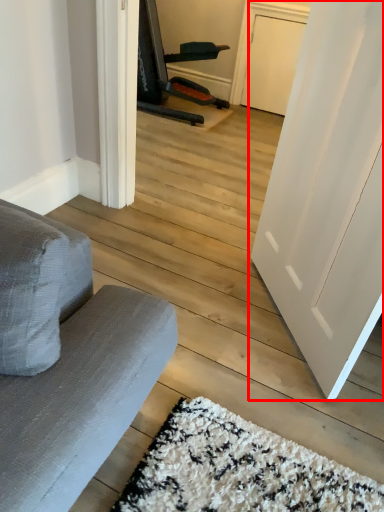
Question: Observing the image, what is the correct spatial positioning of door (annotated by the red box) in reference to armchair?

Choices:
 (A) right
 (B) left

Answer: (A)